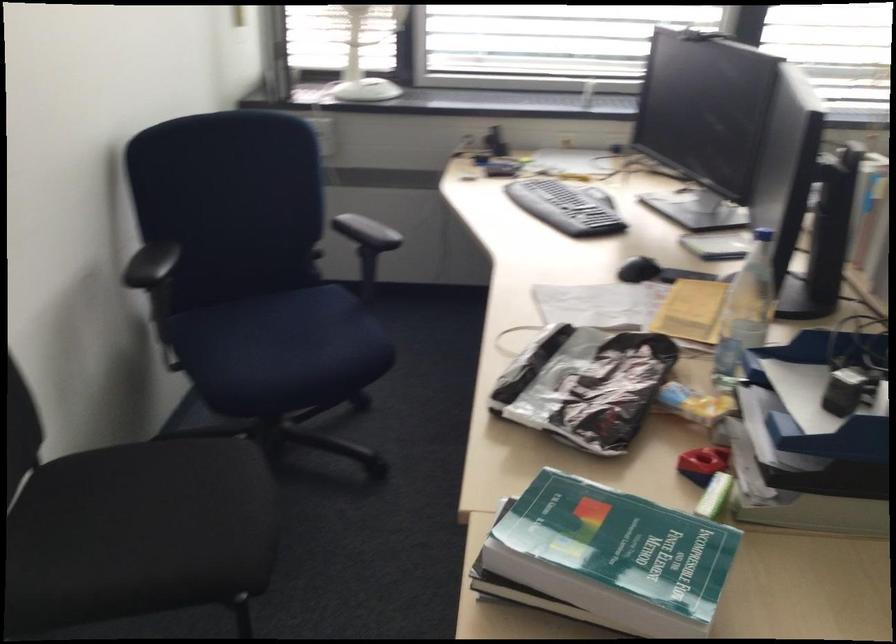
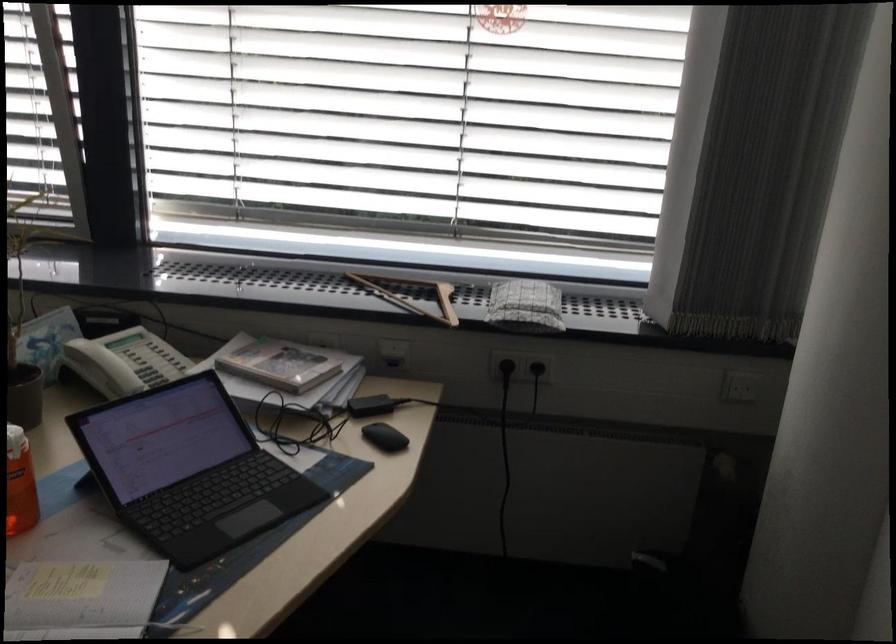
Question: The images are taken continuously from a first-person perspective. In which direction are you moving?

Choices:
 (A) Left
 (B) Right
 (C) Forward
 (D) Backward

Answer: (B)